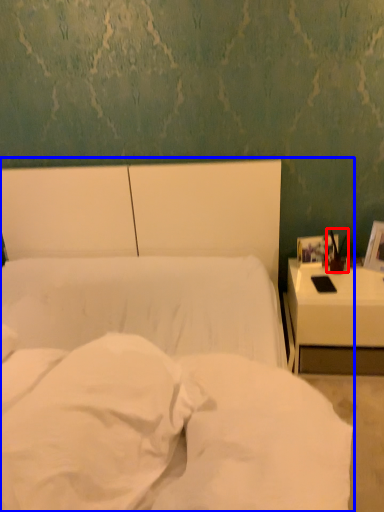
Question: Among these objects, which one is farthest to the camera, bedside lamp (highlighted by a red box) or bed (highlighted by a blue box)?

Choices:
 (A) bedside lamp
 (B) bed

Answer: (A)